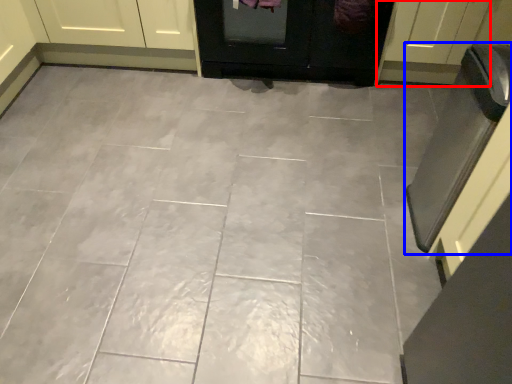
Question: Which object appears closest to the camera in this image, door (highlighted by a red box) or oven (highlighted by a blue box)?

Choices:
 (A) door
 (B) oven

Answer: (B)